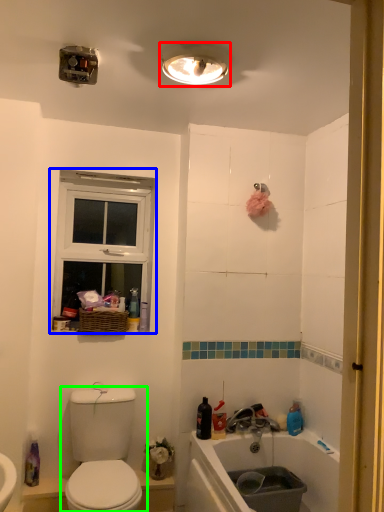
Question: Estimate the real-world distances between objects in this image. Which object is farther from light fixture (highlighted by a red box), window (highlighted by a blue box) or toilet (highlighted by a green box)?

Choices:
 (A) window
 (B) toilet

Answer: (B)